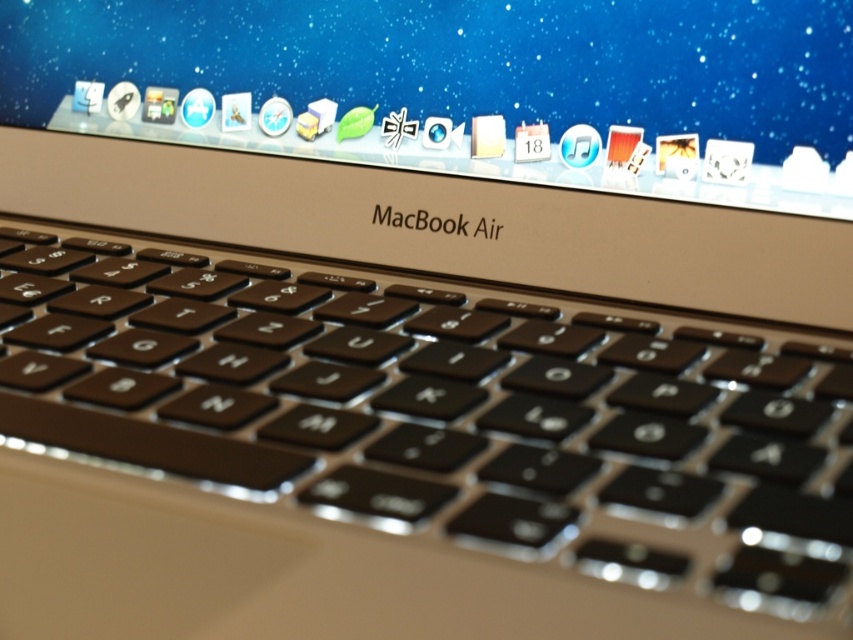
Can you confirm if black matte keyboard at center is bigger than satin silver macbook air at center?

Yes, black matte keyboard at center is bigger than satin silver macbook air at center.

Does black matte keyboard at center appear on the right side of satin silver macbook air at center?

Incorrect, black matte keyboard at center is not on the right side of satin silver macbook air at center.

Identify the location of black matte keyboard at center. (440, 413).